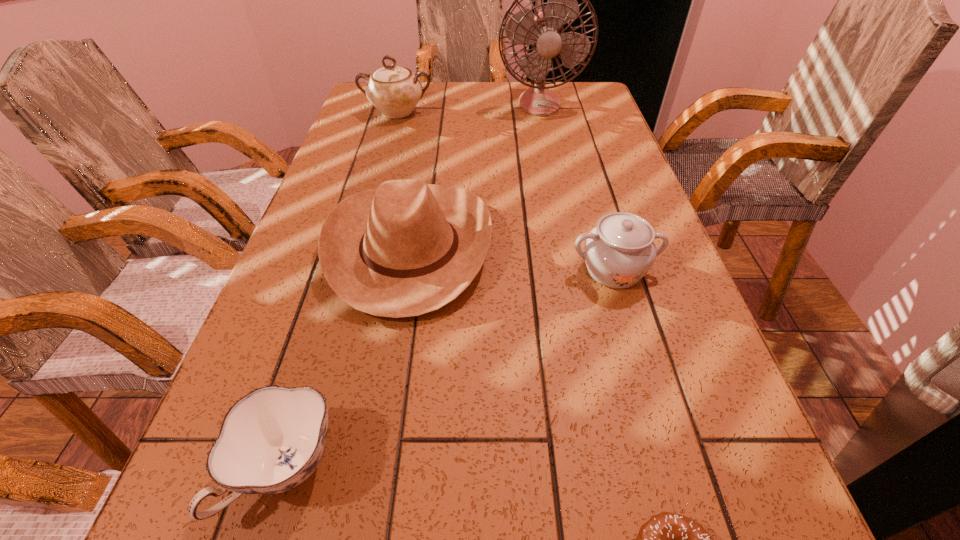
Where is `free location located 0.280m on the back of the second farthest chinaware`? This screenshot has width=960, height=540. free location located 0.280m on the back of the second farthest chinaware is located at coordinates (586, 175).

The height and width of the screenshot is (540, 960). I want to click on free space located 0.280m on the back of the fifth tallest object, so click(x=342, y=285).

The width and height of the screenshot is (960, 540). In order to click on fan at the far edge in this screenshot , I will do `click(543, 30)`.

Identify the location of chinaware situated at the far edge. Image resolution: width=960 pixels, height=540 pixels. (395, 91).

Locate an element on the screen. This screenshot has height=540, width=960. cowboy hat that is at the left edge is located at coordinates (407, 248).

This screenshot has height=540, width=960. Identify the location of fan located at the right edge. (543, 30).

Find the location of `chinaware that is at the right edge`. chinaware that is at the right edge is located at coordinates (620, 250).

Where is `object at the far left corner`? object at the far left corner is located at coordinates (395, 91).

You are a GUI agent. You are given a task and a screenshot of the screen. Output one action in this format:
    pyautogui.click(x=<x>, y=<y>)
    Task: Click on the object present at the far right corner
    The width and height of the screenshot is (960, 540).
    Given the screenshot: What is the action you would take?
    pyautogui.click(x=543, y=30)

Find the location of `vacant space at the right edge of the desktop`. vacant space at the right edge of the desktop is located at coordinates (569, 138).